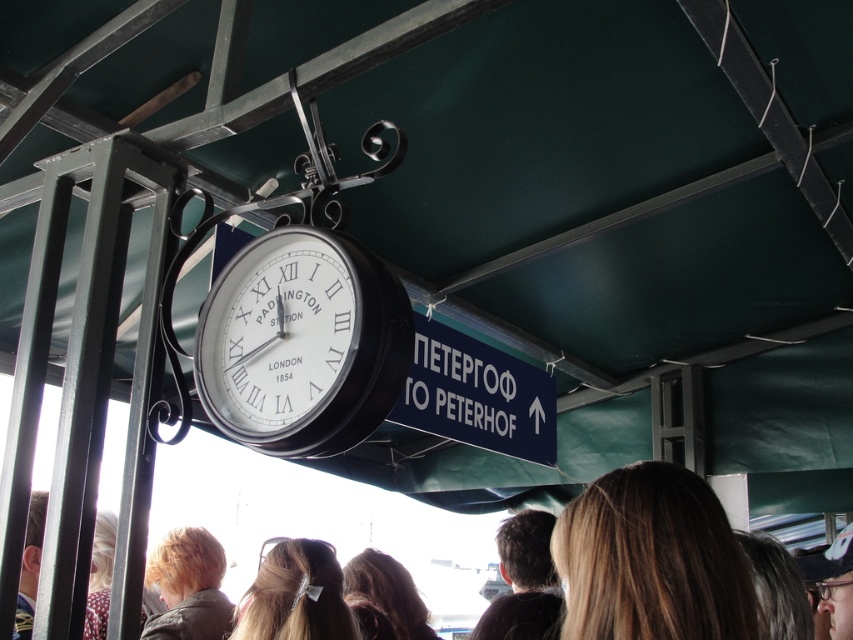
Does white matte clock at center have a larger size compared to dark brown hair at center?

No.

Locate an element on the screen. The image size is (853, 640). white matte clock at center is located at coordinates (302, 342).

I want to click on white matte clock at center, so click(x=302, y=342).

Does point (171, 570) lie behind point (553, 596)?

Yes, it is.

Is blonde hair at lower left thinner than dark brown hair at center?

Incorrect, blonde hair at lower left's width is not less than dark brown hair at center's.

Image resolution: width=853 pixels, height=640 pixels. What are the coordinates of `blonde hair at lower left` in the screenshot? It's located at (189, 586).

Can you confirm if blonde hair with clip at center is positioned to the left of blonde hair at lower left?

In fact, blonde hair with clip at center is to the right of blonde hair at lower left.

You are a GUI agent. You are given a task and a screenshot of the screen. Output one action in this format:
    pyautogui.click(x=<x>, y=<y>)
    Task: Click on the blonde hair with clip at center
    This screenshot has height=640, width=853.
    Given the screenshot: What is the action you would take?
    pyautogui.click(x=294, y=595)

What do you see at coordinates (294, 595) in the screenshot?
I see `blonde hair with clip at center` at bounding box center [294, 595].

Find the location of a particular element. blonde hair with clip at center is located at coordinates (294, 595).